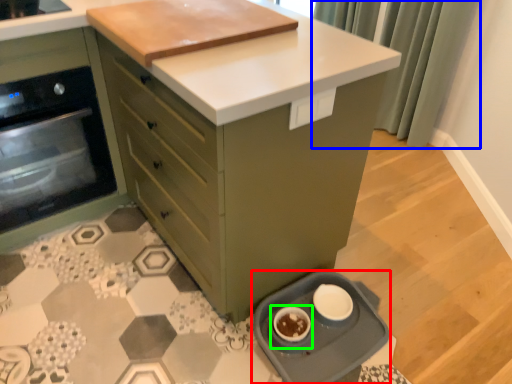
Question: Which is nearer to the kitchen appliance (highlighted by a red box)? curtain (highlighted by a blue box) or appliance (highlighted by a green box).

Choices:
 (A) curtain
 (B) appliance

Answer: (B)